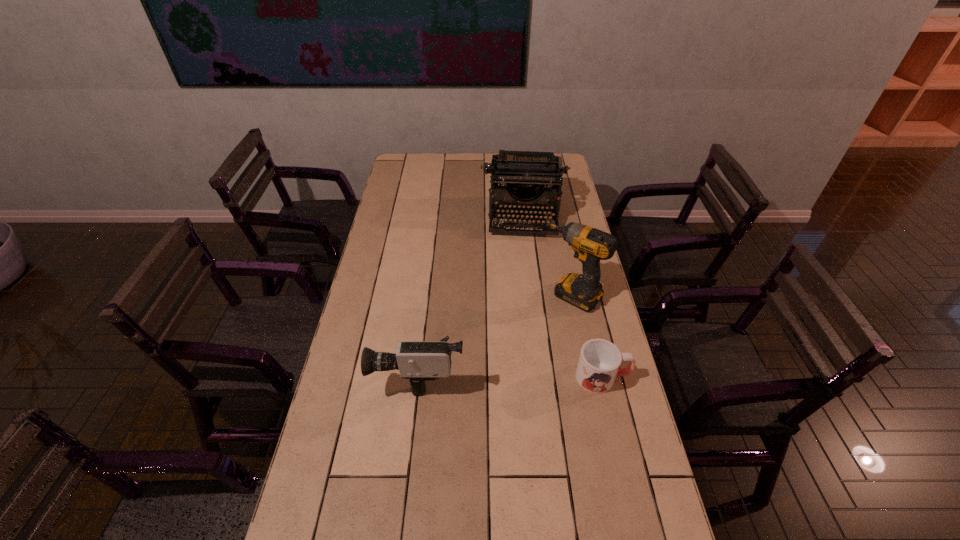
Find the location of a particular element. This screenshot has width=960, height=540. free space that is in between the mug and the drill is located at coordinates (588, 336).

The height and width of the screenshot is (540, 960). What are the coordinates of `vacant space that's between the camcorder and the tallest object` in the screenshot? It's located at (496, 334).

The image size is (960, 540). Identify the location of vacant space that's between the mug and the camcorder. (512, 375).

Choose which object is the third nearest neighbor to the camcorder. Please provide its 2D coordinates. Your answer should be formatted as a tuple, i.e. [(x, y)], where the tuple contains the x and y coordinates of a point satisfying the conditions above.

[(524, 172)]

The width and height of the screenshot is (960, 540). Identify the location of object that is the closest to the camcorder. (584, 291).

This screenshot has height=540, width=960. Find the location of `vacant area in the image that satisfies the following two spatial constraints: 1. on the front side of the drill; 2. on the side of the shortest object with the handle`. vacant area in the image that satisfies the following two spatial constraints: 1. on the front side of the drill; 2. on the side of the shortest object with the handle is located at coordinates (589, 377).

Find the location of a particular element. vacant region that satisfies the following two spatial constraints: 1. on the front side of the mug; 2. on the side of the farthest object with the handle is located at coordinates (544, 377).